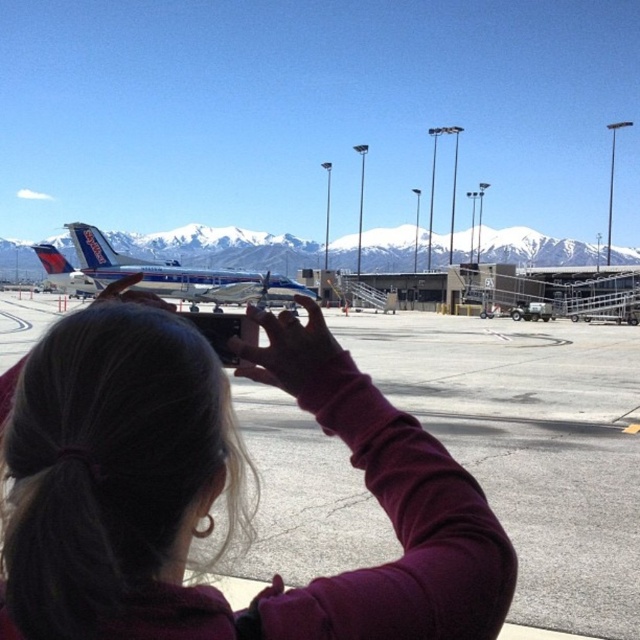
Measure the distance between snowy mountain at center and blue metallic airplane at center.

A distance of 15.90 meters exists between snowy mountain at center and blue metallic airplane at center.

Locate an element on the screen. This screenshot has width=640, height=640. snowy mountain at center is located at coordinates (221, 248).

This screenshot has height=640, width=640. What do you see at coordinates (221, 248) in the screenshot? I see `snowy mountain at center` at bounding box center [221, 248].

Find the location of a particular element. The width and height of the screenshot is (640, 640). snowy mountain at center is located at coordinates pos(221,248).

Is dark purple sweater at center smaller than blue metallic airplane at center?

Correct, dark purple sweater at center occupies less space than blue metallic airplane at center.

What do you see at coordinates (218, 490) in the screenshot? This screenshot has width=640, height=640. I see `dark purple sweater at center` at bounding box center [218, 490].

This screenshot has width=640, height=640. Find the location of `dark purple sweater at center`. dark purple sweater at center is located at coordinates [x=218, y=490].

Who is higher up, dark purple sweater at center or snowy mountain at center?

snowy mountain at center is above.

The width and height of the screenshot is (640, 640). I want to click on dark purple sweater at center, so click(218, 490).